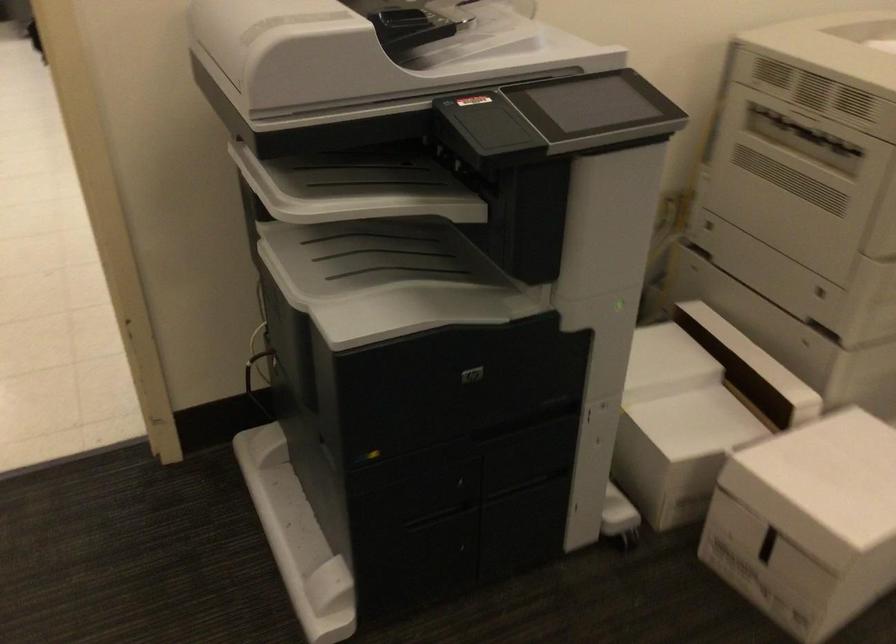
Where would you lift the printer document feeder? Please return your answer as a coordinate pair (x, y).

(354, 187)